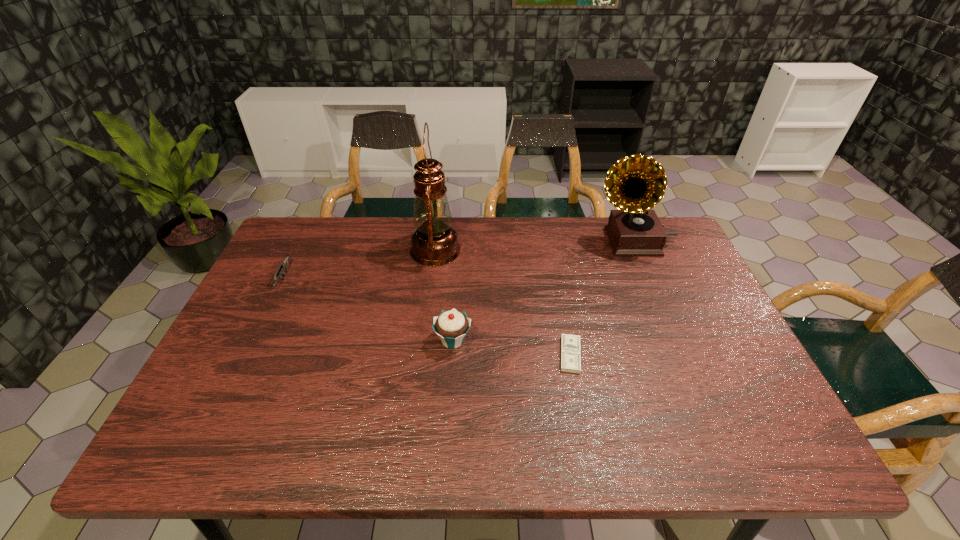
I want to click on oil lamp, so click(434, 242).

I want to click on phonograph record, so click(x=635, y=184).

The image size is (960, 540). I want to click on the rightmost object, so click(x=635, y=184).

At what (x,y) coordinates should I click in order to perform the action: click on the third shortest object. Please return your answer as a coordinate pair (x, y). Looking at the image, I should click on (452, 326).

The image size is (960, 540). I want to click on the second shortest object, so click(x=284, y=265).

Find the location of a particular element. This screenshot has height=540, width=960. the leftmost object is located at coordinates (284, 265).

Locate an element on the screen. the fourth object from left to right is located at coordinates (570, 344).

Locate an element on the screen. Image resolution: width=960 pixels, height=540 pixels. money is located at coordinates [570, 344].

Image resolution: width=960 pixels, height=540 pixels. Identify the location of free space located 0.400m on the front of the oil lamp. (420, 382).

You are a GUI agent. You are given a task and a screenshot of the screen. Output one action in this format:
    pyautogui.click(x=<x>, y=<y>)
    Task: Click on the free space located 0.230m from the horn of the second tallest object
    The image size is (960, 540).
    Given the screenshot: What is the action you would take?
    pyautogui.click(x=521, y=241)